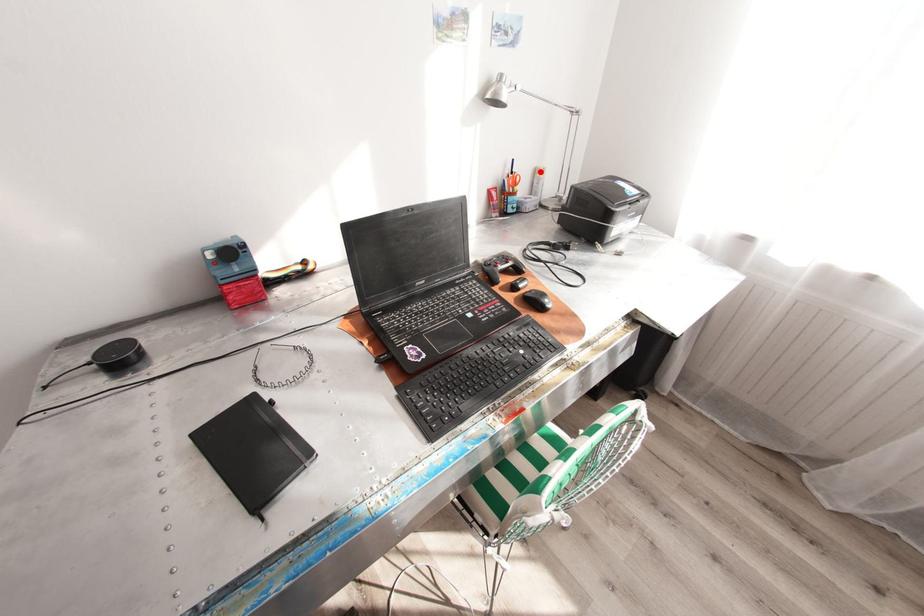
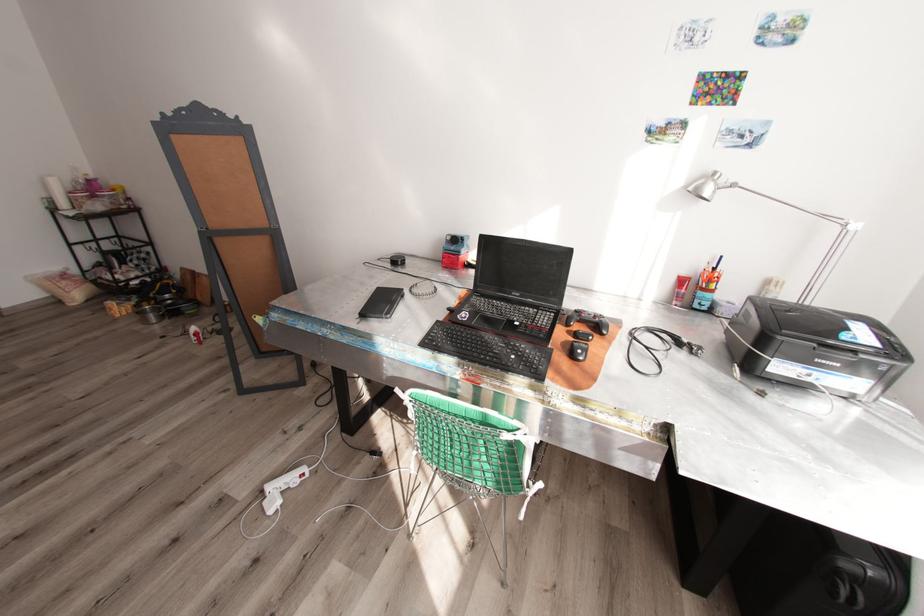
Where in the second image is the point corresponding to the highlighted location from the first image?

(772, 282)